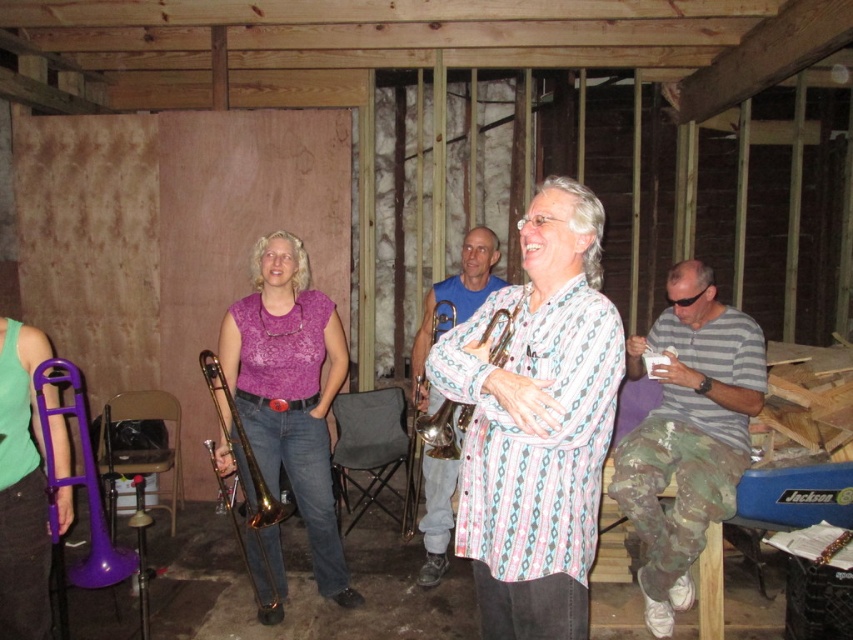
Question: Which of these objects is positioned farthest from the pink patterned shirt at center?

Choices:
 (A) gray striped shirt at right
 (B) gold shiny trumpet at center
 (C) gold brass trombone at center

Answer: (B)

Question: Can you confirm if lace fabric blouse at center is positioned below gold shiny trumpet at center?

Choices:
 (A) no
 (B) yes

Answer: (B)

Question: Is gold brass trombone at center wider than gold shiny trumpet at center?

Choices:
 (A) yes
 (B) no

Answer: (A)

Question: Which of the following is the closest to the observer?

Choices:
 (A) (497, 323)
 (B) (254, 528)
 (C) (733, 509)

Answer: (A)

Question: Can you confirm if gray striped shirt at right is positioned to the left of gold shiny trumpet at center?

Choices:
 (A) no
 (B) yes

Answer: (A)

Question: Which object is positioned farthest from the pink striped shirt at center?

Choices:
 (A) lace fabric blouse at center
 (B) pink patterned shirt at center
 (C) gray striped shirt at right

Answer: (B)